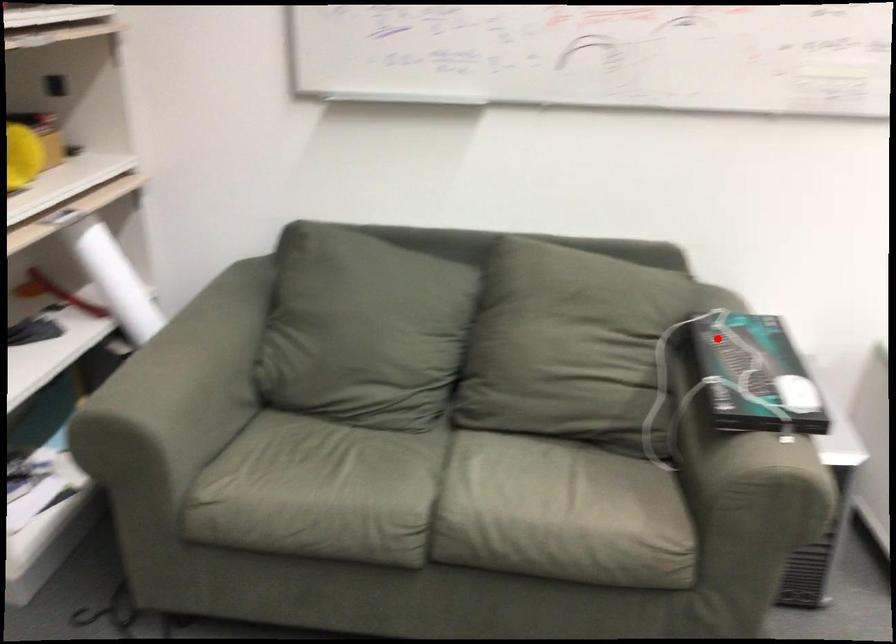
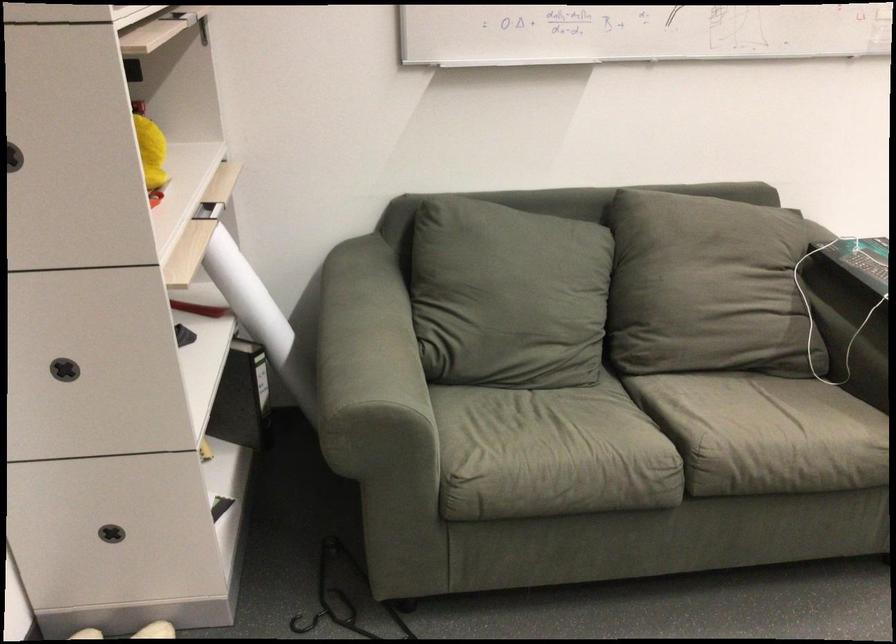
Question: I am providing you with two images of the same scene from different viewpoints. Given a red point in image1, look at the same physical point in image2. Is it:

Choices:
 (A) Closer to the viewpoint
 (B) Farther from the viewpoint

Answer: (B)